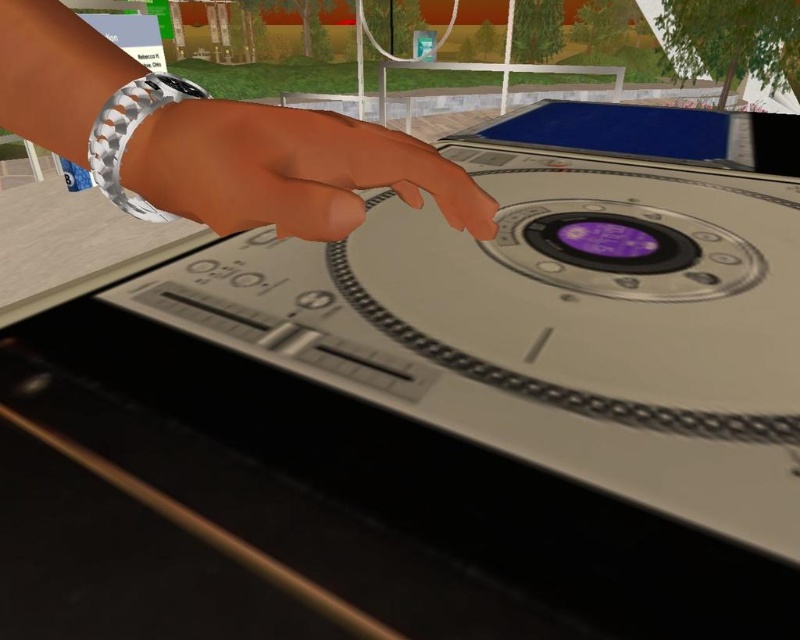
You are a digital artist working on a 3D model of the DJ turntable scene. You need to place a new decorative element at the exact coordinates where the silver metallic watch at upper left is located. What are the coordinates you should use?

The silver metallic watch at upper left is located at coordinates point (208, 140), so you should place the new decorative element at those coordinates.